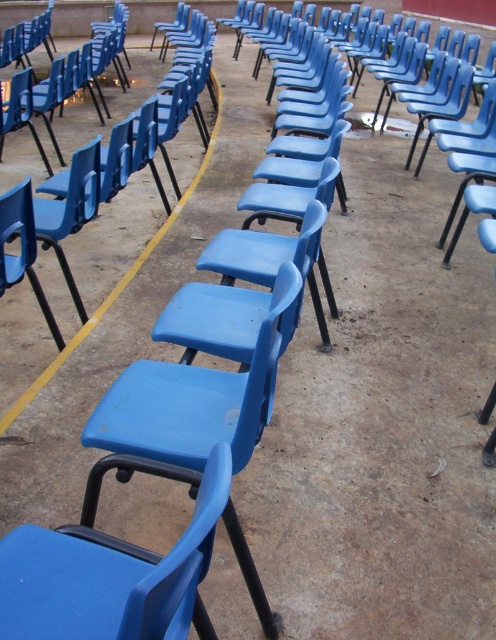
Does blue plastic chair at center come behind matte plastic chair at lower left?

Yes.

Between blue plastic chair at center and matte plastic chair at lower left, which one is positioned higher?

blue plastic chair at center is above.

What are the coordinates of `blue plastic chair at center` in the screenshot? It's located at (118, 282).

Is matte plastic chair at center positioned before blue plastic chair at center?

That is True.

Between matte plastic chair at center and blue plastic chair at center, which one has less height?

matte plastic chair at center is shorter.

Is point (52, 596) closer to viewer compared to point (156, 236)?

Yes, point (52, 596) is in front of point (156, 236).

This screenshot has width=496, height=640. I want to click on matte plastic chair at center, so click(x=110, y=576).

Is matte plastic chair at center positioned before matte plastic chair at lower left?

Yes, matte plastic chair at center is closer to the viewer.

Who is higher up, matte plastic chair at center or matte plastic chair at lower left?

matte plastic chair at lower left is above.

Find the location of a particular element. matte plastic chair at center is located at coordinates (110, 576).

Where is `matte plastic chair at center`? This screenshot has height=640, width=496. matte plastic chair at center is located at coordinates (110, 576).